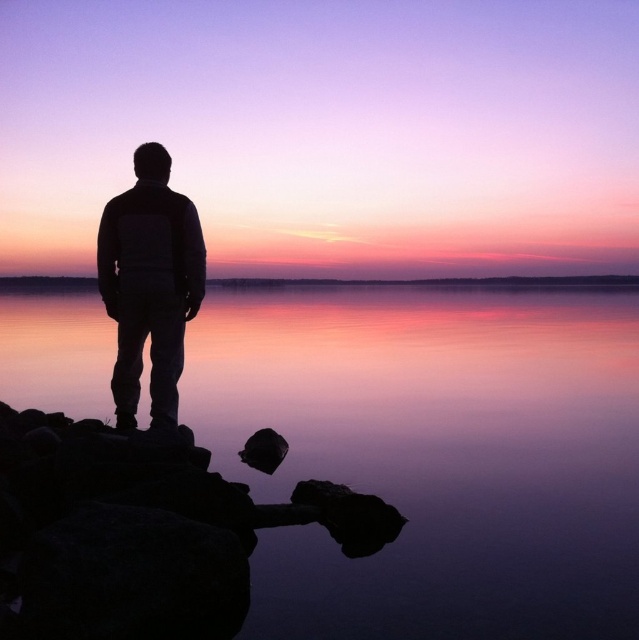
Question: Which point is closer to the camera taking this photo?

Choices:
 (A) (167, 376)
 (B) (512, 449)

Answer: (A)

Question: Can you confirm if smooth water at center is wider than silhouette jacket at center?

Choices:
 (A) no
 (B) yes

Answer: (B)

Question: Is smooth water at center bigger than silhouette jacket at center?

Choices:
 (A) yes
 (B) no

Answer: (A)

Question: Can you confirm if smooth water at center is thinner than silhouette jacket at center?

Choices:
 (A) yes
 (B) no

Answer: (B)

Question: Which point is farther from the camera taking this photo?

Choices:
 (A) (141, 253)
 (B) (592, 541)

Answer: (A)